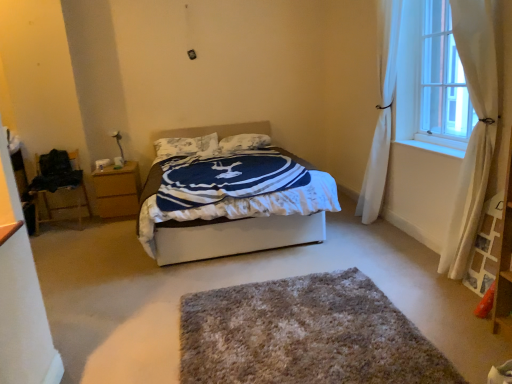
Image resolution: width=512 pixels, height=384 pixels. Find the location of `vacant space behind shaggy gray rug at center`. vacant space behind shaggy gray rug at center is located at coordinates (295, 260).